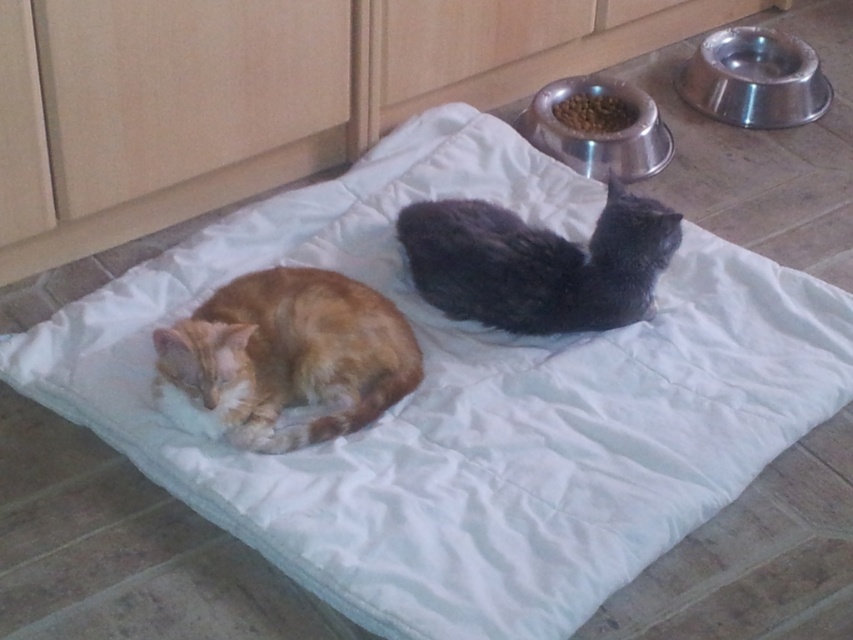
There are two cats on the white quilted mat. The orange fur cat at left and another cat. How far apart are they?

The orange fur cat at left and the other cat are 4.72 feet apart.

Consider the image. You are a cat that is 1.5 feet tall. You want to drink water from the metallic silver bowl at upper right. Can you reach it without jumping?

The metallic silver bowl at upper right is 6.93 feet away from the viewer. Since the cat is only 1.5 feet tall, it would need to jump or move closer to reach the bowl.

You are a pet owner who wants to place a new toy between the orange fur cat at left and the metallic silver bowl at upper right. Based on their positions, which direction should you move the toy to ensure it stays between them?

The orange fur cat at left is in front of the metallic silver bowl at upper right, so to place the toy between them, you should move it towards the orange fur cat at left from the bowl.